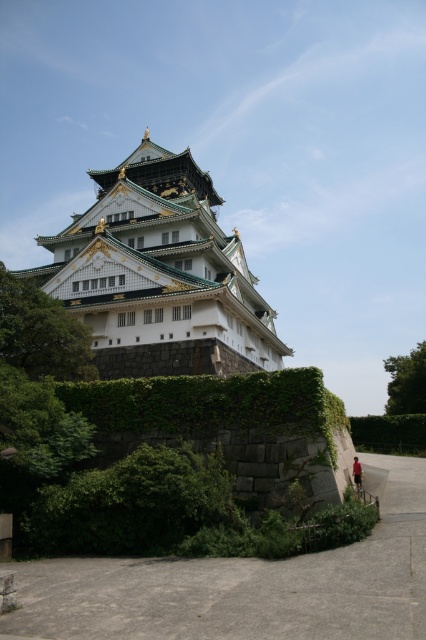
Question: Does white stone palace at center appear on the left side of green leafy hedge at lower right?

Choices:
 (A) no
 (B) yes

Answer: (B)

Question: Can you confirm if white stone palace at center is positioned to the left of green leafy hedge at lower right?

Choices:
 (A) no
 (B) yes

Answer: (B)

Question: Which of the following is the closest to the observer?

Choices:
 (A) (365, 438)
 (B) (134, 259)

Answer: (B)

Question: Which point is farther to the camera?

Choices:
 (A) (391, 435)
 (B) (226, 253)

Answer: (B)

Question: Does white stone palace at center have a lesser width compared to green leafy hedge at lower right?

Choices:
 (A) no
 (B) yes

Answer: (A)